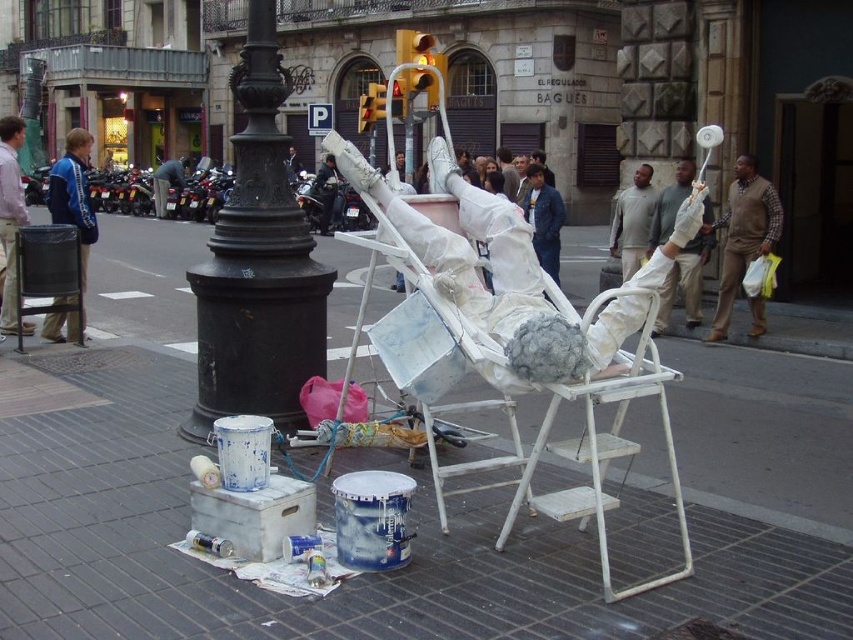
Is white fabric figure at center above blue striped jacket at left?

Actually, white fabric figure at center is below blue striped jacket at left.

Can you confirm if white fabric figure at center is wider than blue striped jacket at left?

In fact, white fabric figure at center might be narrower than blue striped jacket at left.

Is point (495, 378) positioned before point (73, 172)?

Yes, it is in front of point (73, 172).

The height and width of the screenshot is (640, 853). What are the coordinates of `white fabric figure at center` in the screenshot? It's located at (514, 273).

Who is more forward, (732, 252) or (712, 237)?

Point (732, 252) is in front.

Who is more distant from viewer, (735, 196) or (664, 228)?

Point (664, 228)

At what (x,y) coordinates should I click in order to perform the action: click on brown plaid shirt at right. Please return your answer as a coordinate pair (x, y). Looking at the image, I should click on (743, 234).

Consider the image. Is white painted pavement at center behind blue striped jacket at left?

No.

Find the location of a particular element. The width and height of the screenshot is (853, 640). white painted pavement at center is located at coordinates (415, 502).

At what (x,y) coordinates should I click in order to perform the action: click on white painted pavement at center. Please return your answer as a coordinate pair (x, y). The width and height of the screenshot is (853, 640). Looking at the image, I should click on (415, 502).